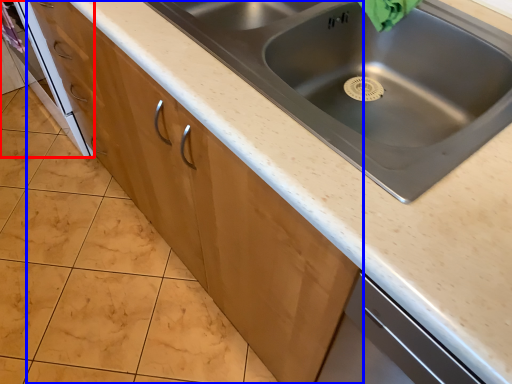
Question: Which point is further to the camera, oven (highlighted by a red box) or cabinetry (highlighted by a blue box)?

Choices:
 (A) oven
 (B) cabinetry

Answer: (A)